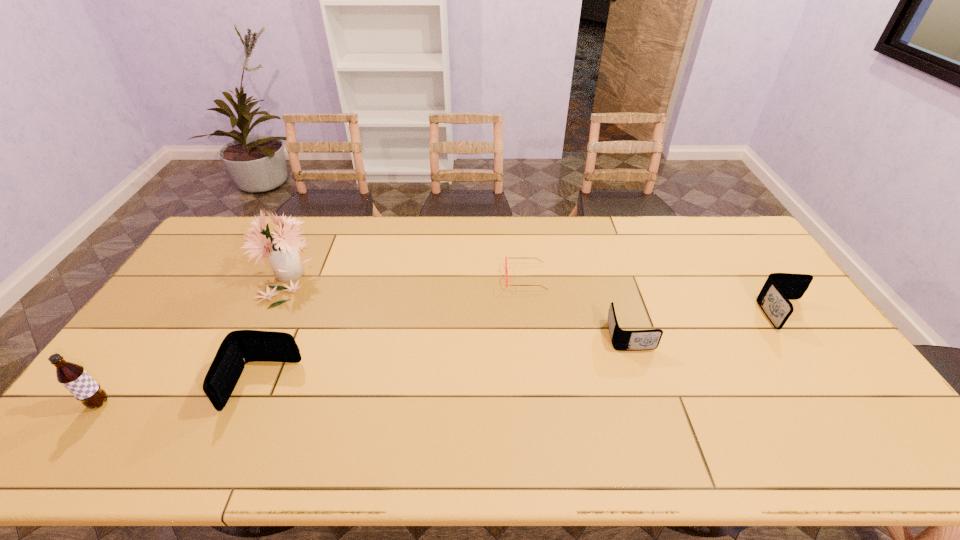
Please point a location where one more wallet can be added evenly. Please provide its 2D coordinates. Your answer should be formatted as a tuple, i.e. [(x, y)], where the tuple contains the x and y coordinates of a point satisfying the conditions above.

[(456, 359)]